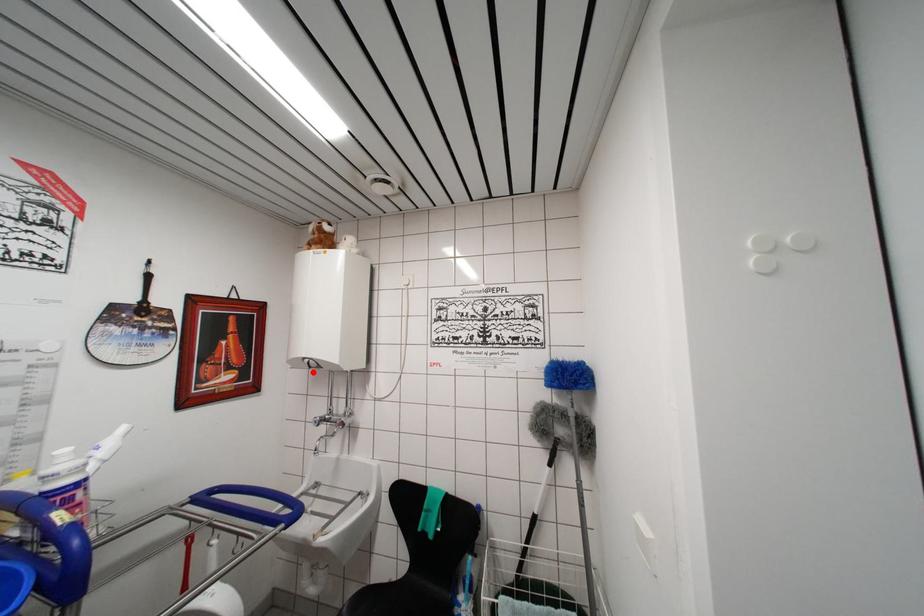
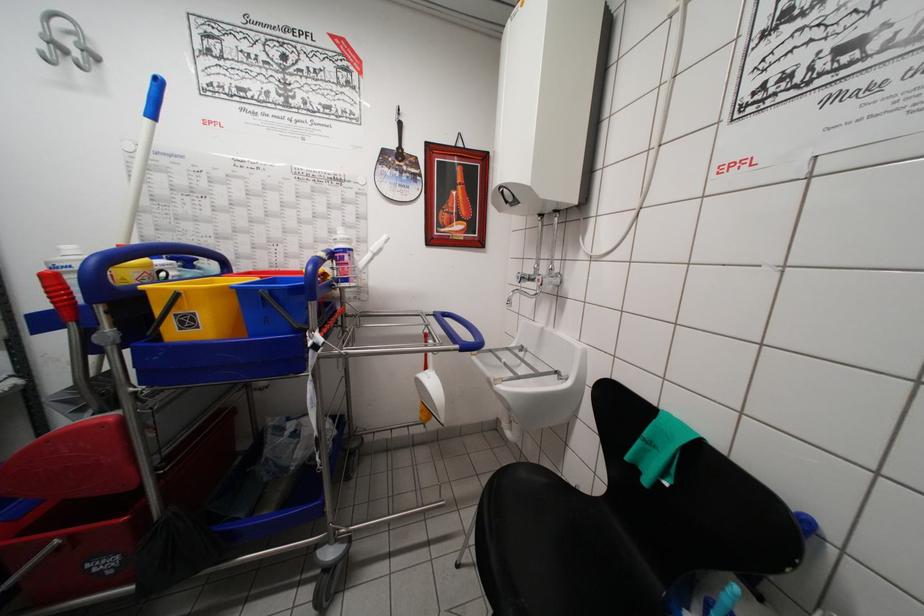
In the second image, find the point that corresponds to the highlighted location in the first image.

(511, 207)